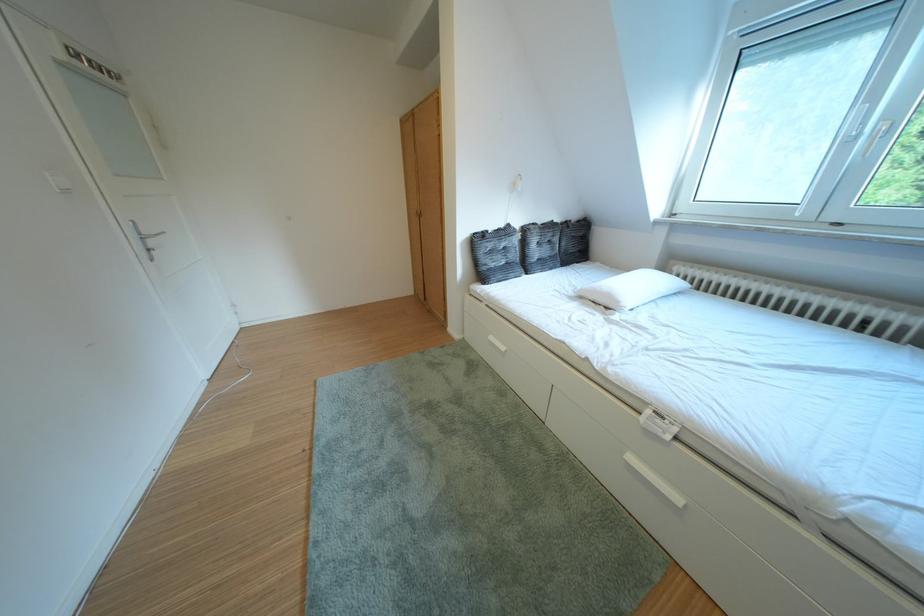
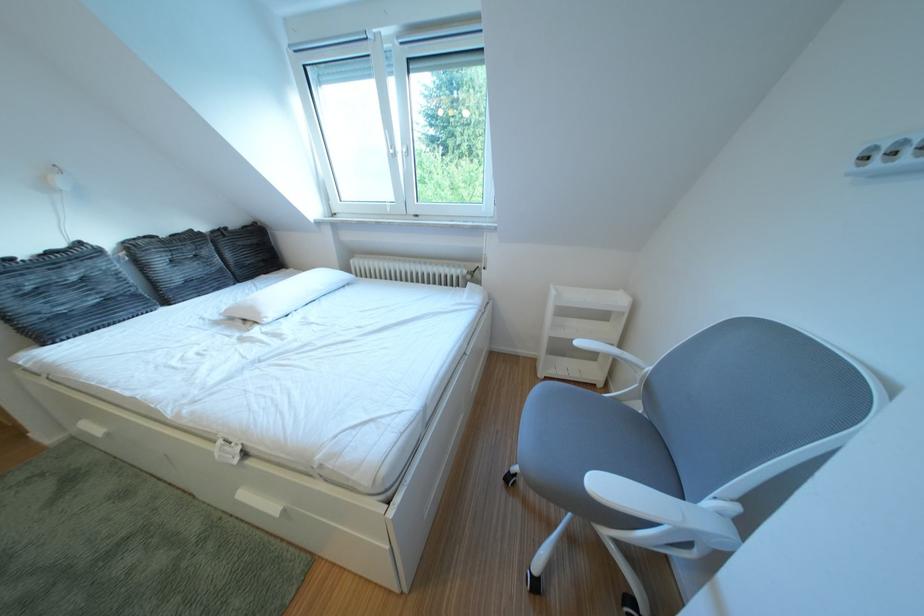
Question: I am providing you with two images of the same scene from different viewpoints. After the viewpoint changes to image2, which objects are now occluded?

Choices:
 (A) dark tufted pillow
 (B) white chair armrest
 (C) white drawer handle
 (D) none of these

Answer: (D)